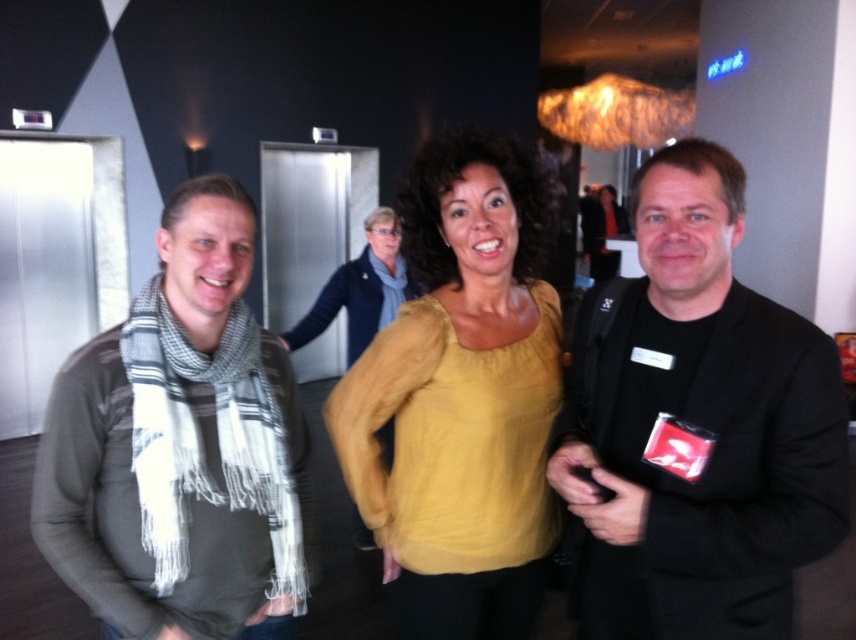
Between plaid scarf at left and yellow soft sweater at center, which one appears on the left side from the viewer's perspective?

From the viewer's perspective, plaid scarf at left appears more on the left side.

Can you confirm if plaid scarf at left is wider than yellow soft sweater at center?

In fact, plaid scarf at left might be narrower than yellow soft sweater at center.

Who is more distant from viewer, (229, 385) or (496, 499)?

The point (496, 499) is behind.

The width and height of the screenshot is (856, 640). What are the coordinates of `plaid scarf at left` in the screenshot? It's located at (179, 445).

Does black matte jacket at right have a larger size compared to plaid scarf at left?

Correct, black matte jacket at right is larger in size than plaid scarf at left.

Between black matte jacket at right and plaid scarf at left, which one appears on the left side from the viewer's perspective?

Positioned to the left is plaid scarf at left.

At what (x,y) coordinates should I click in order to perform the action: click on black matte jacket at right. Please return your answer as a coordinate pair (x, y). Looking at the image, I should click on (697, 426).

Can you confirm if black matte jacket at right is positioned above yellow soft sweater at center?

No, black matte jacket at right is not above yellow soft sweater at center.

Who is more distant from viewer, (730, 326) or (431, 380)?

Point (431, 380)

The height and width of the screenshot is (640, 856). Find the location of `black matte jacket at right`. black matte jacket at right is located at coordinates (697, 426).